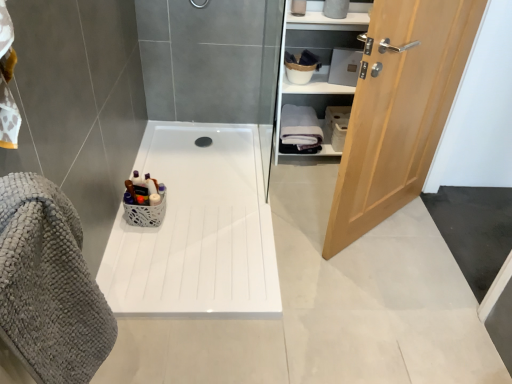
Question: In the image, is gray textured bath towel at left, the 1th bath towel positioned from the front, positioned in front of or behind white glossy bath at center?

Choices:
 (A) front
 (B) behind

Answer: (A)

Question: Based on their sizes in the image, would you say gray textured bath towel at left, acting as the first bath towel starting from the left, is bigger or smaller than white glossy bath at center?

Choices:
 (A) small
 (B) big

Answer: (B)

Question: Based on their relative distances, which object is nearer to the white cotton bath towel at right, which is counted as the 2th bath towel, starting from the bottom?

Choices:
 (A) black rubber drain at center
 (B) white glossy bath at center
 (C) gray textured bath towel at left, which is counted as the second bath towel, starting from the top
 (D) light wood door at right
 (E) white glossy cabinet at upper right

Answer: (E)

Question: Which is nearer to the gray textured bath towel at left, acting as the first bath towel starting from the left?

Choices:
 (A) light wood door at right
 (B) white glossy cabinet at upper right
 (C) white cotton bath towel at right, which ranks as the 2th bath towel in front-to-back order
 (D) black rubber drain at center
 (E) white glossy bath at center

Answer: (E)